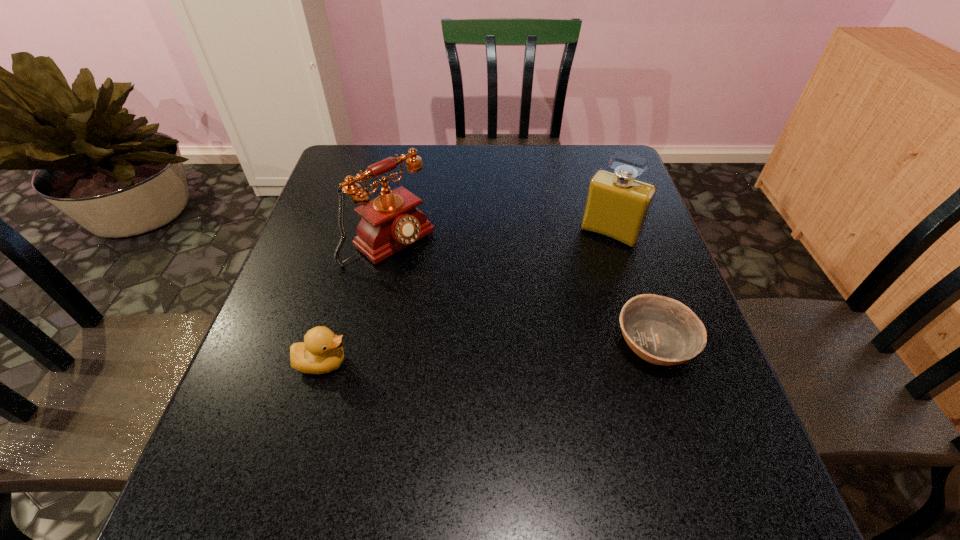
Find the location of a particular element. duckling is located at coordinates (321, 352).

At what (x,y) coordinates should I click in order to perform the action: click on the shortest object. Please return your answer as a coordinate pair (x, y). The height and width of the screenshot is (540, 960). Looking at the image, I should click on (660, 330).

I want to click on perfume, so click(x=617, y=205).

Identify the location of telephone. point(390,222).

At what (x,y) coordinates should I click in order to perform the action: click on vacant space situated 0.050m on the face of the duckling. Please return your answer as a coordinate pair (x, y). Looking at the image, I should click on (376, 362).

Identify the location of free space located 0.280m on the back of the bowl. Image resolution: width=960 pixels, height=540 pixels. (616, 229).

I want to click on free spot located 0.310m on the front-facing side of the perfume, so click(x=544, y=333).

Locate an element on the screen. This screenshot has height=540, width=960. vacant space located on the front-facing side of the perfume is located at coordinates (588, 264).

You are a GUI agent. You are given a task and a screenshot of the screen. Output one action in this format:
    pyautogui.click(x=<x>, y=<y>)
    Task: Click on the vacant space situated 0.350m on the front-facing side of the perfume
    
    Given the screenshot: What is the action you would take?
    (537, 346)

You are a GUI agent. You are given a task and a screenshot of the screen. Output one action in this format:
    pyautogui.click(x=<x>, y=<y>)
    Task: Click on the free spot located on the dial of the telephone
    
    Given the screenshot: What is the action you would take?
    pyautogui.click(x=438, y=278)